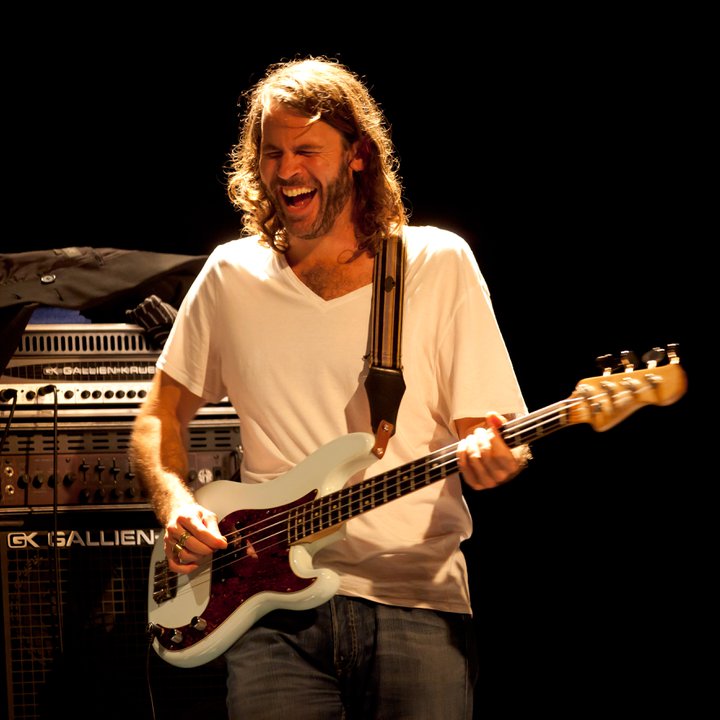
The image size is (720, 720). Identify the location of cord. (55, 436).